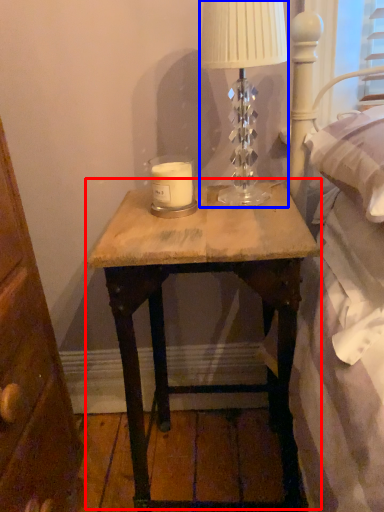
Question: Among these objects, which one is farthest to the camera, nightstand (highlighted by a red box) or table lamp (highlighted by a blue box)?

Choices:
 (A) nightstand
 (B) table lamp

Answer: (B)